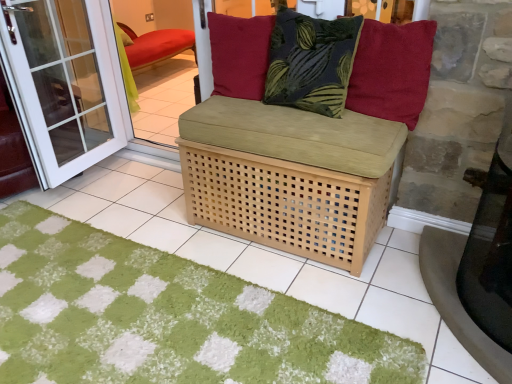
Question: Considering the relative sizes of velvet red cushion at upper center, arranged as the 3th pillow when viewed from the left, and smooth concrete table at lower right in the image provided, is velvet red cushion at upper center, arranged as the 3th pillow when viewed from the left, taller than smooth concrete table at lower right?

Choices:
 (A) no
 (B) yes

Answer: (A)

Question: Is velvet red cushion at upper center, the first pillow positioned from the right, oriented towards smooth concrete table at lower right?

Choices:
 (A) no
 (B) yes

Answer: (A)

Question: Would you say smooth concrete table at lower right is part of velvet red cushion at upper center, arranged as the 3th pillow when viewed from the left,'s contents?

Choices:
 (A) no
 (B) yes

Answer: (A)

Question: From a real-world perspective, is velvet red cushion at upper center, the first pillow positioned from the right, positioned over smooth concrete table at lower right based on gravity?

Choices:
 (A) no
 (B) yes

Answer: (B)

Question: Does velvet red cushion at upper center, the first pillow positioned from the right, have a lesser height compared to smooth concrete table at lower right?

Choices:
 (A) no
 (B) yes

Answer: (B)

Question: Is velvet red cushion at upper center, arranged as the 3th pillow when viewed from the left, to the left of smooth concrete table at lower right from the viewer's perspective?

Choices:
 (A) no
 (B) yes

Answer: (B)

Question: Considering the relative sizes of white glass screen door at left and natural wood basket at center in the image provided, is white glass screen door at left smaller than natural wood basket at center?

Choices:
 (A) yes
 (B) no

Answer: (A)

Question: Considering the relative sizes of white glass screen door at left and natural wood basket at center in the image provided, is white glass screen door at left taller than natural wood basket at center?

Choices:
 (A) no
 (B) yes

Answer: (B)

Question: Does white glass screen door at left have a greater width compared to natural wood basket at center?

Choices:
 (A) yes
 (B) no

Answer: (B)

Question: Are white glass screen door at left and natural wood basket at center far apart?

Choices:
 (A) no
 (B) yes

Answer: (B)

Question: Is white glass screen door at left at the right side of natural wood basket at center?

Choices:
 (A) yes
 (B) no

Answer: (B)

Question: Could you tell me if white glass screen door at left is turned towards natural wood basket at center?

Choices:
 (A) no
 (B) yes

Answer: (B)

Question: From a real-world perspective, is dark green textured pillow at center, arranged as the second pillow when viewed from the right, positioned under green shaggy doormat at center based on gravity?

Choices:
 (A) no
 (B) yes

Answer: (A)